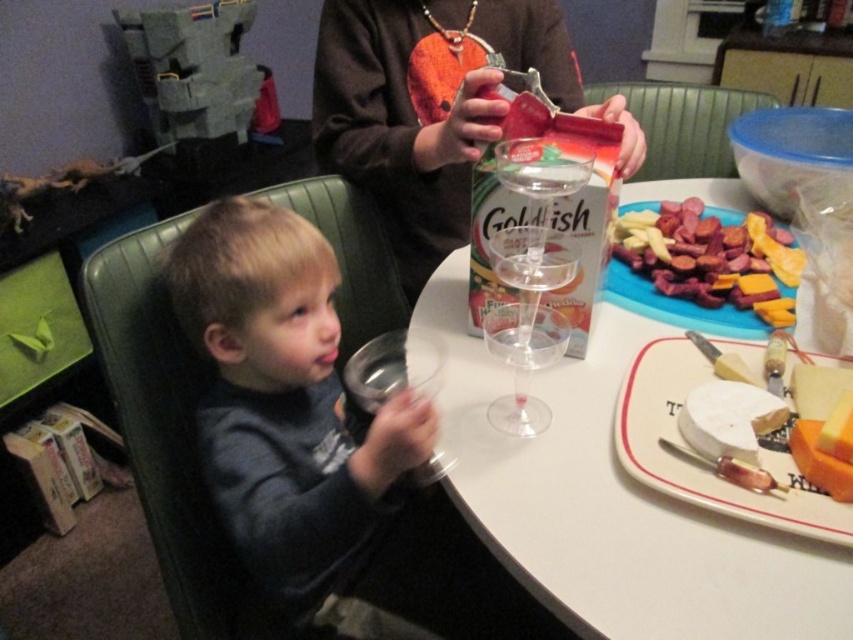
Question: Observing the image, what is the correct spatial positioning of white ceramic platter at lower right in reference to transparent plastic wine glass at center?

Choices:
 (A) below
 (B) above

Answer: (A)

Question: Among these objects, which one is farthest from the camera?

Choices:
 (A) white plastic table at center
 (B) transparent plastic wine glass at center
 (C) green leather chair at left

Answer: (C)

Question: From the image, what is the correct spatial relationship of white ceramic platter at lower right in relation to transparent plastic wine glass at center?

Choices:
 (A) above
 (B) below

Answer: (B)

Question: Which point is farther from the camera taking this photo?

Choices:
 (A) (529, 188)
 (B) (399, 330)
 (C) (659, 376)
 (D) (630, 289)

Answer: (B)

Question: Does green plastic chair at upper center appear under transparent plastic wine glass at center?

Choices:
 (A) yes
 (B) no

Answer: (B)

Question: Estimate the real-world distances between objects in this image. Which object is farther from the matte brown sweater at upper center?

Choices:
 (A) white plastic table at center
 (B) clear glass at center
 (C) sliced sausage at upper right

Answer: (B)